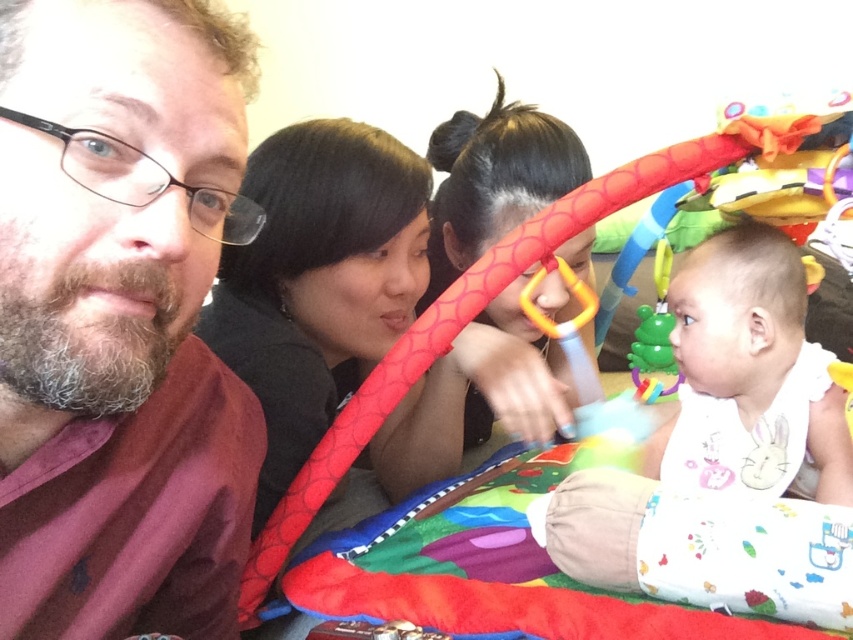
You are a photographer trying to capture a candid shot of the white cotton bib at center without the matte red shirt at left blocking it. What adjustment should you make to your camera position?

The matte red shirt at left is in front of the white cotton bib at center, so you should move your camera position to the right to avoid the obstruction caused by the matte red shirt at left.

Based on the photo, you are a photographer trying to capture a closeup of the baby in the activity center. You need to decide which object to move first to get a clearer view. Which object should you move, the matte red shirt at left or the white soft bib at lower right?

The matte red shirt at left occupies less space than the white soft bib at lower right, so you should move the matte red shirt at left first to get a clearer view.